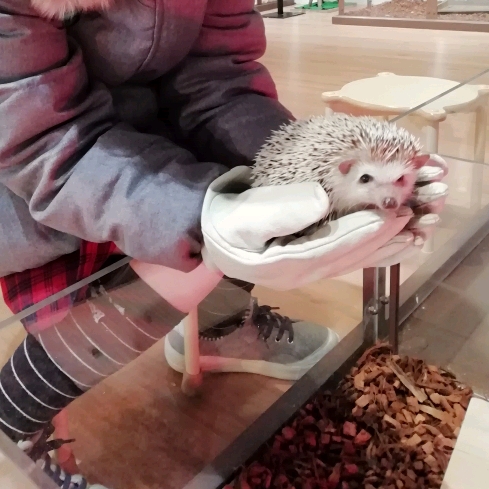
The width and height of the screenshot is (489, 489). What are the coordinates of `table top` in the screenshot? It's located at [x=413, y=95].